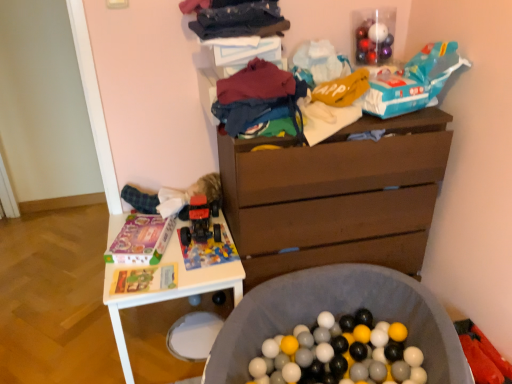
Question: Would you consider multicolored fabric at center, which is counted as the second clothing, starting from the top, to be distant from brick-patterned plastic toy car at center, which appears as the second toy when viewed from the right?

Choices:
 (A) yes
 (B) no

Answer: (B)

Question: Is the surface of multicolored fabric at center, which is counted as the second clothing, starting from the top, in direct contact with brick-patterned plastic toy car at center, the 3th toy in the top-to-bottom sequence?

Choices:
 (A) yes
 (B) no

Answer: (B)

Question: Is multicolored fabric at center, which is counted as the second clothing, starting from the top, shorter than brick-patterned plastic toy car at center, the second toy when ordered from left to right?

Choices:
 (A) yes
 (B) no

Answer: (B)

Question: From a real-world perspective, is multicolored fabric at center, which is counted as the second clothing, starting from the top, under brick-patterned plastic toy car at center, which appears as the second toy when viewed from the right?

Choices:
 (A) no
 (B) yes

Answer: (A)

Question: Is multicolored fabric at center, which is counted as the second clothing, starting from the top, oriented towards brick-patterned plastic toy car at center, the second toy when ordered from left to right?

Choices:
 (A) yes
 (B) no

Answer: (B)

Question: From the image's perspective, is brick-patterned plastic toy car at center, which ranks as the first toy in bottom-to-top order, above or below rubberized plastic toy car at center, which is the 3th toy in right-to-left order?

Choices:
 (A) above
 (B) below

Answer: (B)

Question: Is brick-patterned plastic toy car at center, which appears as the second toy when viewed from the right, bigger or smaller than rubberized plastic toy car at center, the 2th toy ordered from the bottom?

Choices:
 (A) big
 (B) small

Answer: (B)

Question: From a real-world perspective, is brick-patterned plastic toy car at center, which appears as the second toy when viewed from the right, physically located above or below rubberized plastic toy car at center, which ranks as the 2th toy in top-to-bottom order?

Choices:
 (A) below
 (B) above

Answer: (A)

Question: Considering the positions of brick-patterned plastic toy car at center, which appears as the second toy when viewed from the right, and rubberized plastic toy car at center, positioned as the 1th toy in left-to-right order, in the image, is brick-patterned plastic toy car at center, which appears as the second toy when viewed from the right, taller or shorter than rubberized plastic toy car at center, positioned as the 1th toy in left-to-right order,?

Choices:
 (A) tall
 (B) short

Answer: (B)

Question: Looking at their shapes, would you say multicolored fabric at center, which is counted as the second clothing, starting from the top, is wider or thinner than dark blue fabric at upper center, the first clothing from the top?

Choices:
 (A) wide
 (B) thin

Answer: (A)

Question: From a real-world perspective, relative to dark blue fabric at upper center, acting as the 2th clothing starting from the bottom, is multicolored fabric at center, which is counted as the second clothing, starting from the top, vertically above or below?

Choices:
 (A) below
 (B) above

Answer: (A)

Question: Would you say multicolored fabric at center, marked as the 1th clothing in a bottom-to-top arrangement, is to the left or to the right of dark blue fabric at upper center, acting as the 2th clothing starting from the bottom, in the picture?

Choices:
 (A) left
 (B) right

Answer: (B)

Question: Is multicolored fabric at center, which is counted as the second clothing, starting from the top, taller or shorter than dark blue fabric at upper center, acting as the 2th clothing starting from the bottom?

Choices:
 (A) tall
 (B) short

Answer: (A)

Question: From a real-world perspective, is teal cardboard box at upper right, the 3th toy when ordered from bottom to top, above or below brown wooden chest of drawers at center?

Choices:
 (A) below
 (B) above

Answer: (B)

Question: Based on their sizes in the image, would you say teal cardboard box at upper right, the 3th toy when ordered from bottom to top, is bigger or smaller than brown wooden chest of drawers at center?

Choices:
 (A) small
 (B) big

Answer: (A)